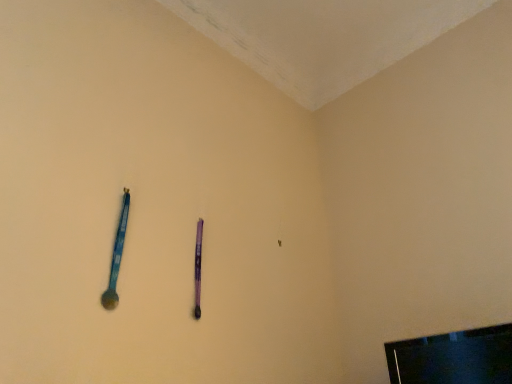
At what (x,y) coordinates should I click in order to perform the action: click on purple matte pen at center. Please return your answer as a coordinate pair (x, y). Looking at the image, I should click on (198, 268).

Would you say black glossy television at lower right is inside or outside purple matte pen at center?

black glossy television at lower right is spatially situated outside purple matte pen at center.

Is black glossy television at lower right next to purple matte pen at center?

black glossy television at lower right is not next to purple matte pen at center, and they're not touching.

Is black glossy television at lower right to the left of purple matte pen at center from the viewer's perspective?

Incorrect, black glossy television at lower right is not on the left side of purple matte pen at center.

From the image's perspective, is black glossy television at lower right located above purple matte pen at center?

No, from the image's perspective, black glossy television at lower right is not over purple matte pen at center.

In terms of width, does blue plastic spoon at left look wider or thinner when compared to black glossy television at lower right?

blue plastic spoon at left is thinner than black glossy television at lower right.

From the image's perspective, which one is positioned lower, blue plastic spoon at left or black glossy television at lower right?

black glossy television at lower right appears lower in the image.

Considering the points (124, 239) and (470, 334), which point is behind, point (124, 239) or point (470, 334)?

The point (124, 239) is more distant.

Based on the photo, is purple matte pen at center at the left side of blue plastic spoon at left?

No, purple matte pen at center is not to the left of blue plastic spoon at left.

Could you tell me if purple matte pen at center is facing blue plastic spoon at left?

No, purple matte pen at center is not oriented towards blue plastic spoon at left.

The width and height of the screenshot is (512, 384). In order to click on spoon lying in front of the purple matte pen at center in this screenshot , I will do `click(116, 256)`.

From a real-world perspective, who is located lower, purple matte pen at center or black glossy television at lower right?

In real-world perspective, black glossy television at lower right is lower.

Considering the sizes of purple matte pen at center and black glossy television at lower right in the image, is purple matte pen at center wider or thinner than black glossy television at lower right?

Clearly, purple matte pen at center has less width compared to black glossy television at lower right.

Considering the positions of objects purple matte pen at center and black glossy television at lower right in the image provided, who is more to the left, purple matte pen at center or black glossy television at lower right?

From the viewer's perspective, purple matte pen at center appears more on the left side.

From the image's perspective, is blue plastic spoon at left on purple matte pen at center?

Indeed, from the image's perspective, blue plastic spoon at left is shown above purple matte pen at center.

Is blue plastic spoon at left positioned before purple matte pen at center?

Yes, blue plastic spoon at left is closer to the viewer.

Is blue plastic spoon at left oriented away from purple matte pen at center?

No, purple matte pen at center is not at the back of blue plastic spoon at left.

Is blue plastic spoon at left next to purple matte pen at center?

No, blue plastic spoon at left is not touching purple matte pen at center.

Which object is more forward, black glossy television at lower right or blue plastic spoon at left?

Positioned in front is black glossy television at lower right.

Does point (494, 369) come farther from viewer compared to point (114, 266)?

No, (494, 369) is closer to viewer.

Consider the image. Are black glossy television at lower right and blue plastic spoon at left making contact?

No, black glossy television at lower right is not touching blue plastic spoon at left.

In order to click on television below the purple matte pen at center (from the image's perspective) in this screenshot , I will do `click(453, 358)`.

You are a GUI agent. You are given a task and a screenshot of the screen. Output one action in this format:
    pyautogui.click(x=<x>, y=<y>)
    Task: Click on the television on the right of blue plastic spoon at left
    
    Given the screenshot: What is the action you would take?
    pyautogui.click(x=453, y=358)

Based on their spatial positions, is blue plastic spoon at left or purple matte pen at center further from black glossy television at lower right?

blue plastic spoon at left is positioned further to the anchor black glossy television at lower right.

Estimate the real-world distances between objects in this image. Which object is further from blue plastic spoon at left, black glossy television at lower right or purple matte pen at center?

black glossy television at lower right lies further to blue plastic spoon at left than the other object.

Based on their spatial positions, is black glossy television at lower right or blue plastic spoon at left closer to purple matte pen at center?

blue plastic spoon at left lies closer to purple matte pen at center than the other object.

Which object lies nearer to the anchor point blue plastic spoon at left, purple matte pen at center or black glossy television at lower right?

purple matte pen at center lies closer to blue plastic spoon at left than the other object.

When comparing their distances from black glossy television at lower right, does purple matte pen at center or blue plastic spoon at left seem further?

blue plastic spoon at left lies further to black glossy television at lower right than the other object.

From the picture: Based on their spatial positions, is blue plastic spoon at left or black glossy television at lower right further from purple matte pen at center?

Based on the image, black glossy television at lower right appears to be further to purple matte pen at center.

Where is `writing between blue plastic spoon at left and black glossy television at lower right from left to right`? writing between blue plastic spoon at left and black glossy television at lower right from left to right is located at coordinates tap(198, 268).